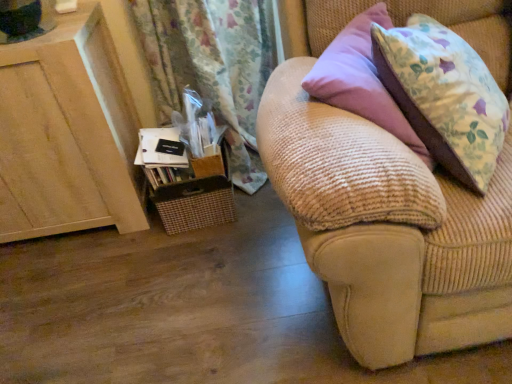
What do you see at coordinates (383, 216) in the screenshot?
I see `beige corduroy couch at right` at bounding box center [383, 216].

Locate an element on the screen. This screenshot has width=512, height=384. beige corduroy couch at right is located at coordinates (383, 216).

What is the approximate height of beige corduroy couch at right?

37.91 inches.

Locate an element on the screen. wooden cabinet at left is located at coordinates click(x=67, y=133).

What do you see at coordinates (67, 133) in the screenshot? I see `wooden cabinet at left` at bounding box center [67, 133].

Where is `beige corduroy couch at right`? beige corduroy couch at right is located at coordinates (383, 216).

Visually, is wooden cabinet at left positioned to the left or to the right of beige corduroy couch at right?

wooden cabinet at left is to the left of beige corduroy couch at right.

Is the depth of wooden cabinet at left greater than that of beige corduroy couch at right?

Yes, wooden cabinet at left is behind beige corduroy couch at right.

Considering the points (28, 213) and (466, 192), which point is behind, point (28, 213) or point (466, 192)?

The point (28, 213) is more distant.

From the image's perspective, is wooden cabinet at left below beige corduroy couch at right?

Yes, from the image's perspective, wooden cabinet at left is beneath beige corduroy couch at right.

From a real-world perspective, which object rests below the other?

wooden cabinet at left, from a real-world perspective.

Does wooden cabinet at left have a greater width compared to beige corduroy couch at right?

In fact, wooden cabinet at left might be narrower than beige corduroy couch at right.

Which of these two, wooden cabinet at left or beige corduroy couch at right, stands taller?

Standing taller between the two is beige corduroy couch at right.

Based on their sizes in the image, would you say wooden cabinet at left is bigger or smaller than beige corduroy couch at right?

wooden cabinet at left is smaller than beige corduroy couch at right.

Which is correct: wooden cabinet at left is inside beige corduroy couch at right, or outside of it?

wooden cabinet at left is spatially situated outside beige corduroy couch at right.

Would you consider wooden cabinet at left to be distant from beige corduroy couch at right?

That's not correct — wooden cabinet at left is a little close to beige corduroy couch at right.

Does wooden cabinet at left turn towards beige corduroy couch at right?

No.

Can you tell me how much wooden cabinet at left and beige corduroy couch at right differ in facing direction?

There is a 0.695-degree angle between the facing directions of wooden cabinet at left and beige corduroy couch at right.

Identify the location of studio couch above the wooden cabinet at left (from a real-world perspective). (383, 216).

Does beige corduroy couch at right appear on the right side of wooden cabinet at left?

Yes.

Considering the relative positions of beige corduroy couch at right and wooden cabinet at left in the image provided, is beige corduroy couch at right behind wooden cabinet at left?

No, beige corduroy couch at right is closer to the viewer.

Which is behind, point (432, 348) or point (103, 198)?

The point (103, 198) is farther.

From the image's perspective, between beige corduroy couch at right and wooden cabinet at left, who is located below?

From the image's view, wooden cabinet at left is below.

From a real-world perspective, between beige corduroy couch at right and wooden cabinet at left, who is vertically higher?

beige corduroy couch at right is physically above.

In terms of width, does beige corduroy couch at right look wider or thinner when compared to wooden cabinet at left?

beige corduroy couch at right is wider than wooden cabinet at left.

Which of these two, beige corduroy couch at right or wooden cabinet at left, stands taller?

beige corduroy couch at right.

Is beige corduroy couch at right smaller than wooden cabinet at left?

Incorrect, beige corduroy couch at right is not smaller in size than wooden cabinet at left.

Would you say wooden cabinet at left is part of beige corduroy couch at right's contents?

Definitely not — wooden cabinet at left is not inside beige corduroy couch at right.

Is beige corduroy couch at right in contact with wooden cabinet at left?

No, beige corduroy couch at right is not in contact with wooden cabinet at left.

Is beige corduroy couch at right facing away from wooden cabinet at left?

No.

Where is `furniture on the left of the beige corduroy couch at right`? The height and width of the screenshot is (384, 512). furniture on the left of the beige corduroy couch at right is located at coordinates 67,133.

Find the location of a particular element. This screenshot has height=384, width=512. furniture behind the beige corduroy couch at right is located at coordinates (67, 133).

Find the location of a particular element. This screenshot has width=512, height=384. studio couch on the right of wooden cabinet at left is located at coordinates click(x=383, y=216).